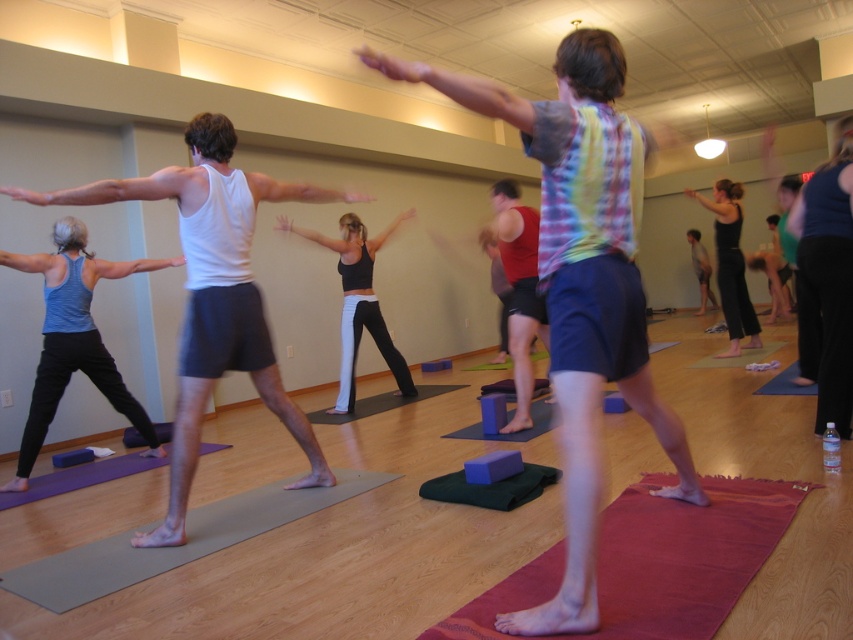
Question: Does black fabric yoga pants at center have a larger size compared to purple rubber yoga mat at lower left?

Choices:
 (A) yes
 (B) no

Answer: (A)

Question: Which is nearer to the purple rubber yoga mat at lower left?

Choices:
 (A) black fabric yoga pants at center
 (B) red textured yoga mat at lower right
 (C) white matte tank top at center

Answer: (C)

Question: Which of the following is the farthest from the observer?

Choices:
 (A) gray rubber yoga mat at lower left
 (B) plaid fabric shirt at center
 (C) red matte yoga block at center

Answer: (C)

Question: Which point is closer to the camera taking this photo?

Choices:
 (A) (688, 572)
 (B) (518, 428)
 (C) (86, 468)
 (D) (537, 634)

Answer: (D)

Question: Can you confirm if red textured yoga mat at lower right is positioned to the right of red matte yoga block at center?

Choices:
 (A) no
 (B) yes

Answer: (B)

Question: Can you confirm if red textured yoga mat at lower right is positioned to the right of gray rubber yoga mat at lower left?

Choices:
 (A) no
 (B) yes

Answer: (B)